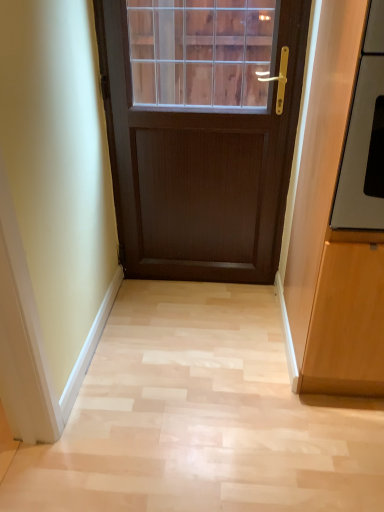
Question: Is light wood floor at center surrounding matte wood cabinet at right?

Choices:
 (A) yes
 (B) no

Answer: (B)

Question: Is light wood floor at center at the right side of matte wood cabinet at right?

Choices:
 (A) yes
 (B) no

Answer: (B)

Question: Considering the relative sizes of light wood floor at center and matte wood cabinet at right in the image provided, is light wood floor at center bigger than matte wood cabinet at right?

Choices:
 (A) yes
 (B) no

Answer: (B)

Question: Is light wood floor at center beside matte wood cabinet at right?

Choices:
 (A) yes
 (B) no

Answer: (B)

Question: Are light wood floor at center and matte wood cabinet at right far apart?

Choices:
 (A) yes
 (B) no

Answer: (B)

Question: From a real-world perspective, is light wood floor at center on top of matte wood cabinet at right?

Choices:
 (A) yes
 (B) no

Answer: (B)

Question: Is matte wood cabinet at right touching satin silver oven at right?

Choices:
 (A) yes
 (B) no

Answer: (B)

Question: Does matte wood cabinet at right have a lesser width compared to satin silver oven at right?

Choices:
 (A) yes
 (B) no

Answer: (A)

Question: From a real-world perspective, is matte wood cabinet at right under satin silver oven at right?

Choices:
 (A) no
 (B) yes

Answer: (B)

Question: Is matte wood cabinet at right facing away from satin silver oven at right?

Choices:
 (A) no
 (B) yes

Answer: (B)

Question: Is matte wood cabinet at right oriented towards satin silver oven at right?

Choices:
 (A) no
 (B) yes

Answer: (B)

Question: Considering the relative sizes of matte wood cabinet at right and satin silver oven at right in the image provided, is matte wood cabinet at right taller than satin silver oven at right?

Choices:
 (A) yes
 (B) no

Answer: (A)

Question: Does matte wood cabinet at right have a lesser width compared to light wood floor at center?

Choices:
 (A) no
 (B) yes

Answer: (B)